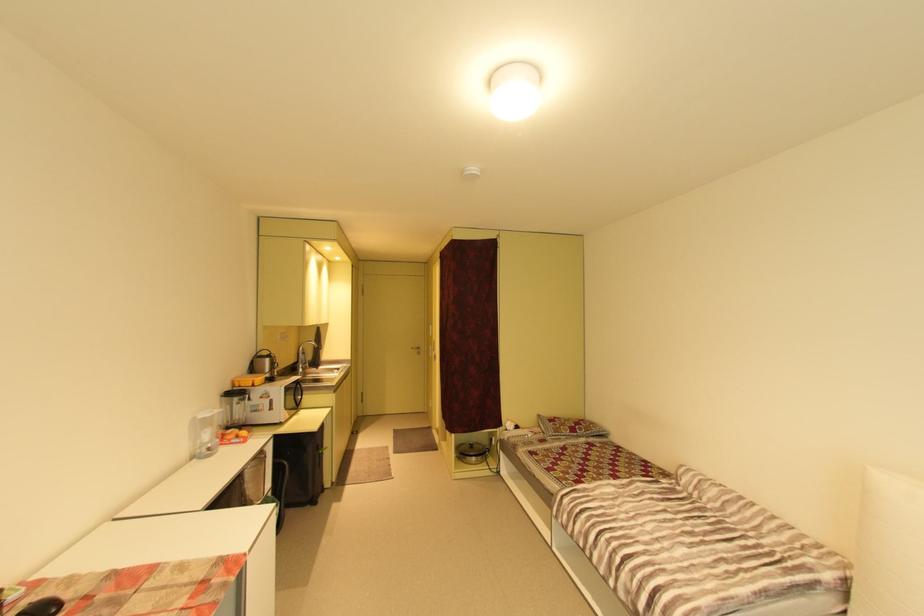
The image size is (924, 616). Describe the element at coordinates (415, 350) in the screenshot. I see `the silver door handle` at that location.